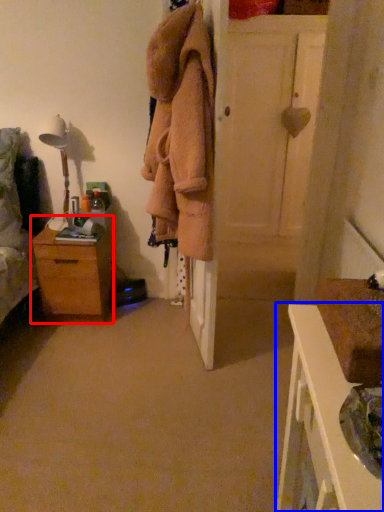
Question: Which point is further to the camera, chest of drawers (highlighted by a red box) or nightstand (highlighted by a blue box)?

Choices:
 (A) chest of drawers
 (B) nightstand

Answer: (A)